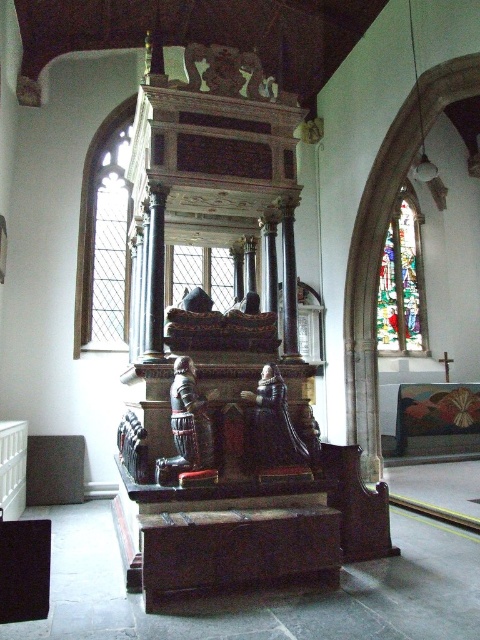
Question: Which point is closer to the camera?

Choices:
 (A) polished dark wood statue at center
 (B) clear glass window at center
 (C) clear glass window at left

Answer: (A)

Question: Can you confirm if polished dark wood statue at center is wider than wooden statue at center?

Choices:
 (A) yes
 (B) no

Answer: (A)

Question: Is polished dark wood statue at center to the left of clear glass window at center from the viewer's perspective?

Choices:
 (A) yes
 (B) no

Answer: (B)

Question: Based on their relative distances, which object is nearer to the stained glass window at upper right?

Choices:
 (A) polished dark wood statue at center
 (B) clear glass window at left
 (C) wooden statue at center
 (D) clear glass window at center

Answer: (D)

Question: In this image, where is wooden statue at center located relative to clear glass window at center?

Choices:
 (A) below
 (B) above

Answer: (A)

Question: Which point is closer to the camera?

Choices:
 (A) polished dark wood statue at center
 (B) wooden statue at center
 (C) stained glass window at upper right
 (D) clear glass window at center

Answer: (B)